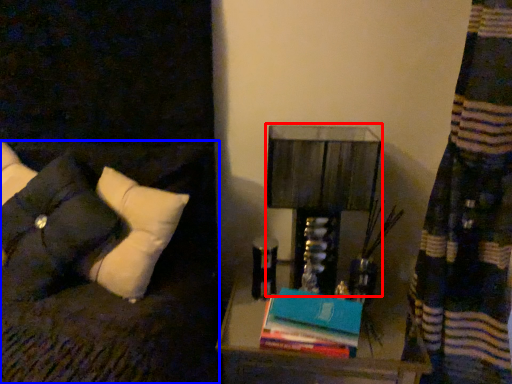
Question: Which of the following is the farthest to the observer, table lamp (highlighted by a red box) or furniture (highlighted by a blue box)?

Choices:
 (A) table lamp
 (B) furniture

Answer: (A)